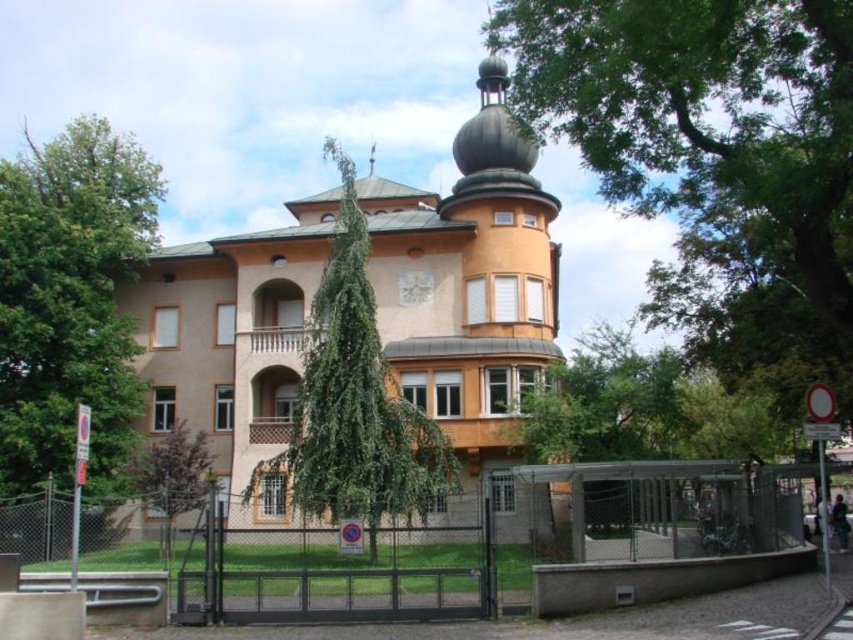
Question: Where is green leafy tree at upper center located in relation to green leafy tree at left in the image?

Choices:
 (A) above
 (B) below

Answer: (B)

Question: Estimate the real-world distances between objects in this image. Which object is farther from the green leafy tree at upper center?

Choices:
 (A) purple leafy tree at lower left
 (B) green leafy tree at center
 (C) black metal fence at lower center
 (D) green leafy tree at left

Answer: (D)

Question: Among these objects, which one is nearest to the camera?

Choices:
 (A) green leafy tree at center
 (B) green leafy tree at upper center
 (C) black metal fence at lower center

Answer: (B)

Question: Does green leafy tree at upper center have a larger size compared to green leafy tree at center?

Choices:
 (A) no
 (B) yes

Answer: (B)

Question: Can you confirm if green leafy tree at center is wider than purple leafy tree at lower left?

Choices:
 (A) no
 (B) yes

Answer: (B)

Question: Which point is farther to the camera?

Choices:
 (A) (91, 483)
 (B) (614, 68)

Answer: (A)